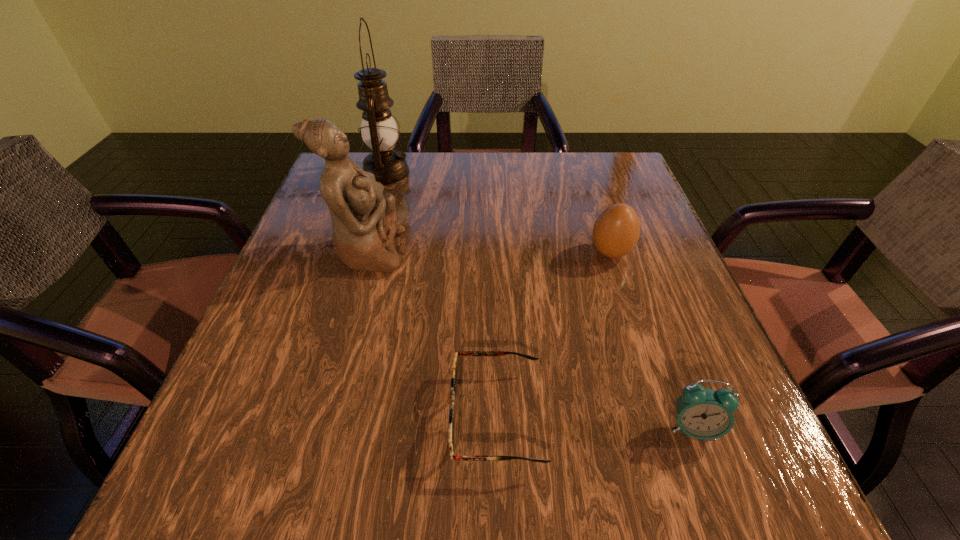
You are a GUI agent. You are given a task and a screenshot of the screen. Output one action in this format:
    pyautogui.click(x=<x>, y=<y>)
    Task: Click on the blank space located on the face of the fourth tallest object
    The height and width of the screenshot is (540, 960).
    Given the screenshot: What is the action you would take?
    pyautogui.click(x=719, y=498)

The height and width of the screenshot is (540, 960). I want to click on vacant space located 0.110m on the frame of the spectacles, so click(x=374, y=416).

Find the location of a particular element. The height and width of the screenshot is (540, 960). free space located 0.160m on the frame of the spectacles is located at coordinates (340, 416).

At what (x,y) coordinates should I click in order to perform the action: click on vacant space located on the frame of the spectacles. Please return your answer as a coordinate pair (x, y). Looking at the image, I should click on (299, 416).

Locate an element on the screen. The image size is (960, 540). object that is at the far edge is located at coordinates (379, 131).

At what (x,y) coordinates should I click in order to perform the action: click on object that is at the near edge. Please return your answer as a coordinate pair (x, y). The height and width of the screenshot is (540, 960). Looking at the image, I should click on (453, 381).

Identify the location of oil lamp located in the left edge section of the desktop. (379, 131).

The image size is (960, 540). What are the coordinates of `figurine positioned at the left edge` in the screenshot? It's located at (364, 221).

Where is `boiled egg that is at the right edge`? Image resolution: width=960 pixels, height=540 pixels. boiled egg that is at the right edge is located at coordinates (616, 231).

You are a GUI agent. You are given a task and a screenshot of the screen. Output one action in this format:
    pyautogui.click(x=<x>, y=<y>)
    Task: Click on the alarm clock present at the right edge
    The width and height of the screenshot is (960, 540).
    Given the screenshot: What is the action you would take?
    pyautogui.click(x=701, y=413)